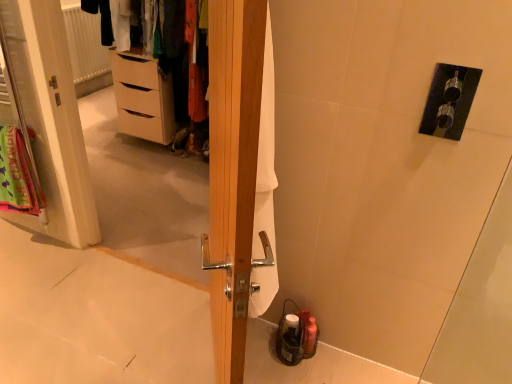
In order to click on wooden door at center in this screenshot , I will do `click(234, 170)`.

Find the location of a particular element. Image resolution: width=512 pixels, height=384 pixels. white fabric screen door at left is located at coordinates (50, 119).

Find the location of a particular element. This screenshot has width=512, height=384. neon green fabric at left is located at coordinates (18, 175).

Describe the element at coordinates (143, 98) in the screenshot. I see `light brown wooden chest of drawers at left` at that location.

What is the approximate width of light brown wooden chest of drawers at left?

light brown wooden chest of drawers at left is 19.60 inches in width.

At what (x,y) coordinates should I click in order to perform the action: click on white textured radiator at upper left. Please return your answer as a coordinate pair (x, y). The image size is (512, 384). Looking at the image, I should click on (85, 43).

I want to click on matte white dresser at upper left, so click(158, 73).

Between light brown wooden chest of drawers at left and white fabric screen door at left, which one has more height?

white fabric screen door at left is taller.

Is light brown wooden chest of drawers at left bigger or smaller than white fabric screen door at left?

Considering their sizes, light brown wooden chest of drawers at left takes up more space than white fabric screen door at left.

Which of these two, light brown wooden chest of drawers at left or white fabric screen door at left, is thinner?

white fabric screen door at left.

From a real-world perspective, is light brown wooden chest of drawers at left located higher than white fabric screen door at left?

No, from a real-world perspective, light brown wooden chest of drawers at left is not over white fabric screen door at left

From the image's perspective, between white textured radiator at upper left and white fabric screen door at left, which one is located above?

white textured radiator at upper left is shown above in the image.

Can we say white textured radiator at upper left lies outside white fabric screen door at left?

Yes.

Considering the sizes of white textured radiator at upper left and white fabric screen door at left in the image, is white textured radiator at upper left taller or shorter than white fabric screen door at left?

Considering their sizes, white textured radiator at upper left has less height than white fabric screen door at left.

From a real-world perspective, is neon green fabric at left physically located above or below white fabric screen door at left?

From a real-world perspective, neon green fabric at left is physically below white fabric screen door at left.

In terms of size, does neon green fabric at left appear bigger or smaller than white fabric screen door at left?

In the image, neon green fabric at left appears to be smaller than white fabric screen door at left.

Is neon green fabric at left not near white fabric screen door at left?

No, neon green fabric at left is not far away from white fabric screen door at left.

You are a GUI agent. You are given a task and a screenshot of the screen. Output one action in this format:
    pyautogui.click(x=<x>, y=<y>)
    Task: Click on the bath towel that is behind the white fabric screen door at left
    This screenshot has height=384, width=512.
    Given the screenshot: What is the action you would take?
    pyautogui.click(x=18, y=175)

Is white fabric screen door at left placed right next to wooden door at center?

No, white fabric screen door at left is not in contact with wooden door at center.

Is white fabric screen door at left in front of wooden door at center?

No, it is not.

Is white fabric screen door at left turned away from wooden door at center?

No, wooden door at center is not at the back of white fabric screen door at left.

Does white fabric screen door at left have a greater height compared to wooden door at center?

Incorrect, the height of white fabric screen door at left is not larger of that of wooden door at center.

Which is closer, (84, 72) or (118, 76)?

Point (84, 72) is farther from the camera than point (118, 76).

At what (x,y) coordinates should I click in order to perform the action: click on radiator above the light brown wooden chest of drawers at left (from a real-world perspective). Please return your answer as a coordinate pair (x, y). Image resolution: width=512 pixels, height=384 pixels. Looking at the image, I should click on (85, 43).

From the image's perspective, which is below, white textured radiator at upper left or light brown wooden chest of drawers at left?

light brown wooden chest of drawers at left, from the image's perspective.

Considering the sizes of objects white textured radiator at upper left and wooden door at center in the image provided, who is smaller, white textured radiator at upper left or wooden door at center?

white textured radiator at upper left.

Would you say white textured radiator at upper left contains wooden door at center?

Definitely not — wooden door at center is not inside white textured radiator at upper left.

Is white textured radiator at upper left looking in the opposite direction of wooden door at center?

white textured radiator at upper left is not turned away from wooden door at center.

Consider the image. Is white textured radiator at upper left beside wooden door at center?

No, white textured radiator at upper left is not beside wooden door at center.

Is point (87, 171) closer to viewer compared to point (163, 131)?

Yes, point (87, 171) is in front of point (163, 131).

What's the angular difference between white fabric screen door at left and matte white dresser at upper left's facing directions?

0.0668 degrees separate the facing orientations of white fabric screen door at left and matte white dresser at upper left.

From their relative heights in the image, would you say white fabric screen door at left is taller or shorter than matte white dresser at upper left?

Considering their sizes, white fabric screen door at left has more height than matte white dresser at upper left.

At what (x,y) coordinates should I click in order to perform the action: click on screen door on the left of light brown wooden chest of drawers at left. Please return your answer as a coordinate pair (x, y). Looking at the image, I should click on (50, 119).

Find the location of a particular element. The image size is (512, 384). radiator below the white fabric screen door at left (from a real-world perspective) is located at coordinates (85, 43).

Estimate the real-world distances between objects in this image. Which object is further from matte white dresser at upper left, neon green fabric at left or wooden door at center?

The object further to matte white dresser at upper left is wooden door at center.

From the image, which object appears to be nearer to matte white dresser at upper left, wooden door at center or white textured radiator at upper left?

The object closer to matte white dresser at upper left is white textured radiator at upper left.

When comparing their distances from wooden door at center, does matte white dresser at upper left or neon green fabric at left seem further?

matte white dresser at upper left.

Based on their spatial positions, is white textured radiator at upper left or neon green fabric at left closer to matte white dresser at upper left?

neon green fabric at left is closer to matte white dresser at upper left.

Estimate the real-world distances between objects in this image. Which object is closer to light brown wooden chest of drawers at left, white textured radiator at upper left or wooden door at center?

Based on the image, white textured radiator at upper left appears to be nearer to light brown wooden chest of drawers at left.

Estimate the real-world distances between objects in this image. Which object is closer to white textured radiator at upper left, matte white dresser at upper left or white fabric screen door at left?

Based on the image, matte white dresser at upper left appears to be nearer to white textured radiator at upper left.

Based on their spatial positions, is white fabric screen door at left or white textured radiator at upper left further from neon green fabric at left?

white textured radiator at upper left lies further to neon green fabric at left than the other object.

From the image, which object appears to be farther from matte white dresser at upper left, white textured radiator at upper left or white fabric screen door at left?

Among the two, white textured radiator at upper left is located further to matte white dresser at upper left.

Identify the location of the chest of drawers located between white fabric screen door at left and white textured radiator at upper left in the depth direction. The image size is (512, 384). (143, 98).

Find the location of a particular element. The height and width of the screenshot is (384, 512). chest of drawers between neon green fabric at left and white textured radiator at upper left along the z-axis is located at coordinates (143, 98).

At what (x,y) coordinates should I click in order to perform the action: click on dresser between white fabric screen door at left and white textured radiator at upper left in the front-back direction. Please return your answer as a coordinate pair (x, y). Looking at the image, I should click on (158, 73).

Where is `screen door between wooden door at center and light brown wooden chest of drawers at left in the front-back direction`? Image resolution: width=512 pixels, height=384 pixels. screen door between wooden door at center and light brown wooden chest of drawers at left in the front-back direction is located at coordinates (50, 119).